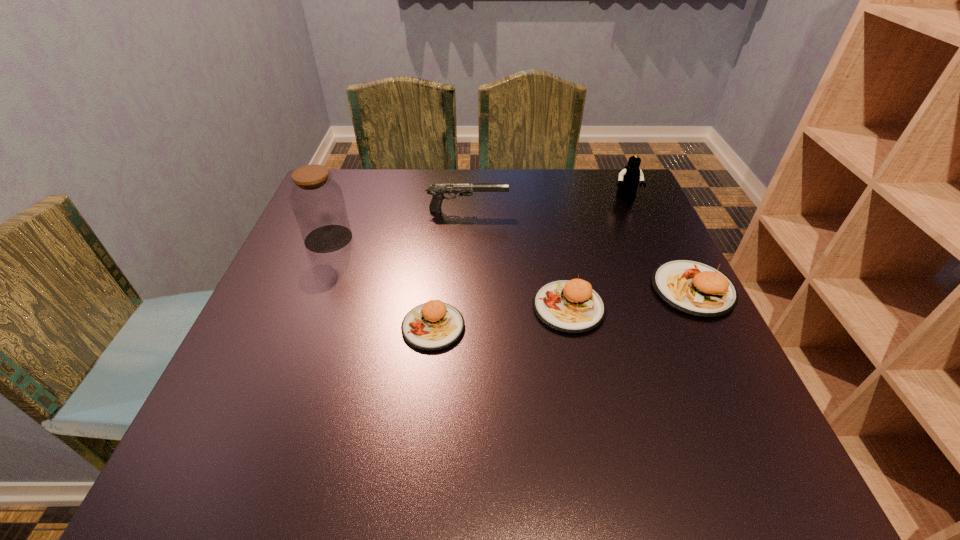
Where is `the shortest patty`? The height and width of the screenshot is (540, 960). the shortest patty is located at coordinates (434, 325).

At what (x,y) coordinates should I click in order to perform the action: click on the shortest object. Please return your answer as a coordinate pair (x, y). Looking at the image, I should click on (434, 325).

This screenshot has width=960, height=540. Identify the location of the second patty from right to left. (571, 306).

Where is `the fourth object from left to right`? This screenshot has width=960, height=540. the fourth object from left to right is located at coordinates (571, 306).

Locate an element on the screen. This screenshot has width=960, height=540. the rightmost patty is located at coordinates (692, 287).

Locate an element on the screen. The image size is (960, 540). the second farthest object is located at coordinates tap(437, 191).

Image resolution: width=960 pixels, height=540 pixels. Find the location of `Lego`. Lego is located at coordinates (629, 178).

You are a GUI agent. You are given a task and a screenshot of the screen. Output one action in this format:
    pyautogui.click(x=<x>, y=<y>)
    Task: Click on the second tallest object
    Image resolution: width=960 pixels, height=540 pixels.
    Given the screenshot: What is the action you would take?
    pyautogui.click(x=629, y=178)

You are a GUI agent. You are given a task and a screenshot of the screen. Output one action in this format:
    pyautogui.click(x=<x>, y=<y>)
    Task: Click on the jar
    The image size is (960, 540).
    Given the screenshot: What is the action you would take?
    (317, 200)

This screenshot has width=960, height=540. I want to click on the tallest object, so click(x=317, y=200).